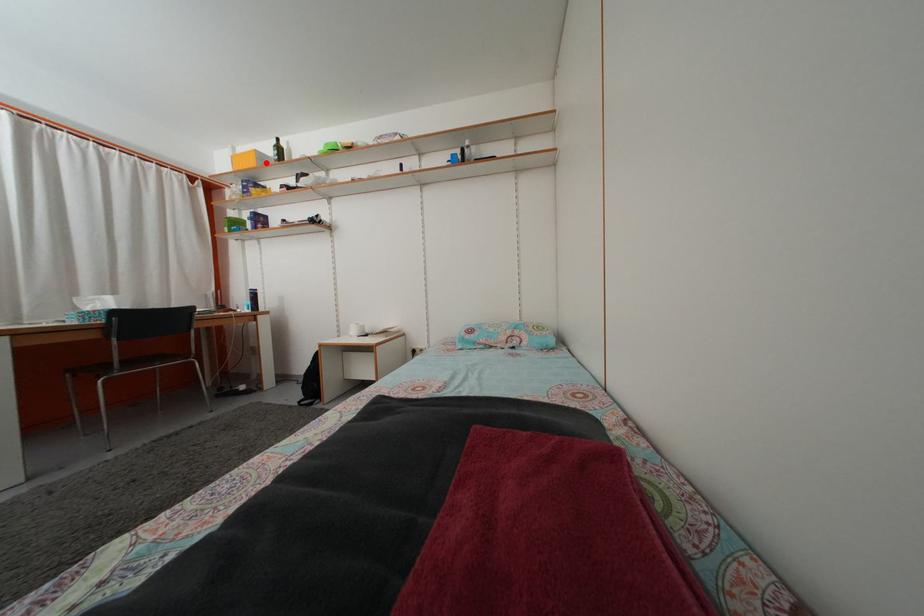
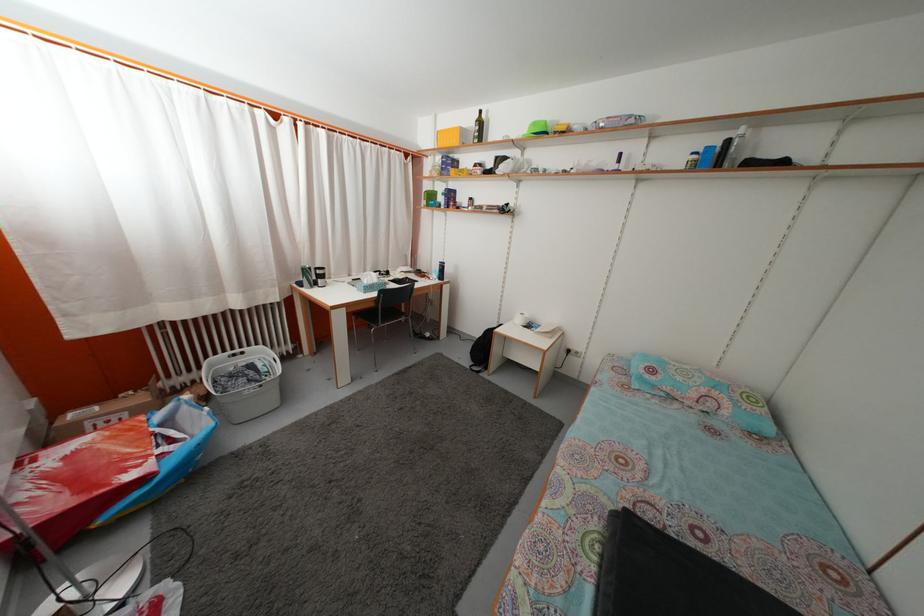
Locate, in the second image, the point that corresponds to the highlighted location in the first image.

(468, 139)